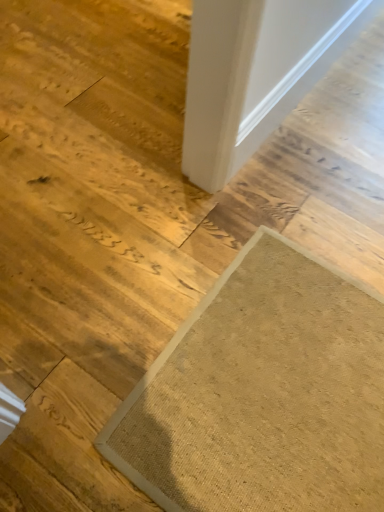
Question: Is textured beige mat at lower right far away from white smooth door at upper right?

Choices:
 (A) no
 (B) yes

Answer: (A)

Question: Considering the relative positions of textured beige mat at lower right and white smooth door at upper right in the image provided, is textured beige mat at lower right in front of white smooth door at upper right?

Choices:
 (A) no
 (B) yes

Answer: (B)

Question: Is textured beige mat at lower right thinner than white smooth door at upper right?

Choices:
 (A) no
 (B) yes

Answer: (A)

Question: Could you tell me if textured beige mat at lower right is facing white smooth door at upper right?

Choices:
 (A) no
 (B) yes

Answer: (A)

Question: Would you say textured beige mat at lower right is outside white smooth door at upper right?

Choices:
 (A) yes
 (B) no

Answer: (A)

Question: Is textured beige mat at lower right wider than white smooth door at upper right?

Choices:
 (A) yes
 (B) no

Answer: (A)

Question: Can you confirm if white smooth door at upper right is wider than textured beige mat at lower right?

Choices:
 (A) no
 (B) yes

Answer: (A)

Question: Is white smooth door at upper right aimed at textured beige mat at lower right?

Choices:
 (A) no
 (B) yes

Answer: (A)

Question: Is white smooth door at upper right touching textured beige mat at lower right?

Choices:
 (A) no
 (B) yes

Answer: (A)

Question: Is white smooth door at upper right bigger than textured beige mat at lower right?

Choices:
 (A) yes
 (B) no

Answer: (B)

Question: Is white smooth door at upper right far away from textured beige mat at lower right?

Choices:
 (A) yes
 (B) no

Answer: (B)

Question: Can you confirm if white smooth door at upper right is taller than textured beige mat at lower right?

Choices:
 (A) no
 (B) yes

Answer: (B)

Question: In the image, is white smooth door at upper right positioned in front of or behind textured beige mat at lower right?

Choices:
 (A) behind
 (B) front

Answer: (A)